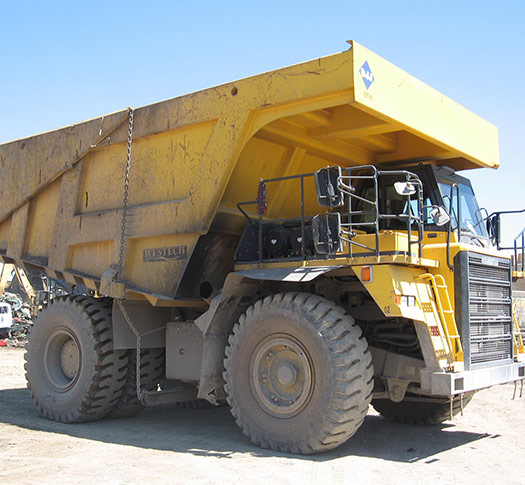
Locate an element on the screen. The width and height of the screenshot is (525, 485). mirror is located at coordinates (439, 217).